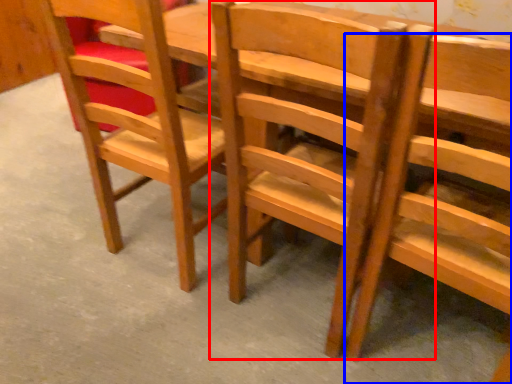
Question: Among these objects, which one is farthest to the camera, chair (highlighted by a red box) or chair (highlighted by a blue box)?

Choices:
 (A) chair
 (B) chair

Answer: (A)